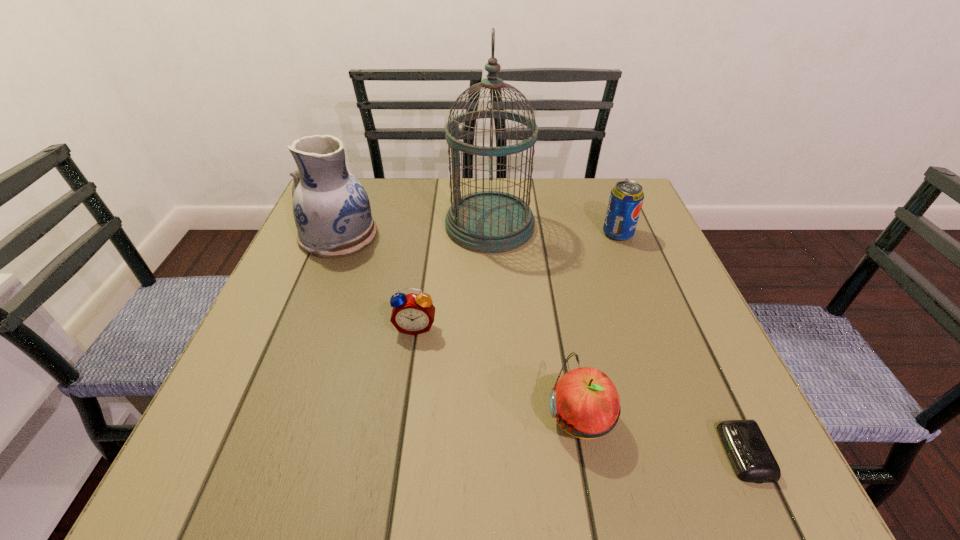
Find the location of a particular element. free space between the right alarm clock and the tallest object is located at coordinates (616, 339).

Image resolution: width=960 pixels, height=540 pixels. Find the location of `unoccupied position between the shorter alarm clock and the second tallest object`. unoccupied position between the shorter alarm clock and the second tallest object is located at coordinates (541, 344).

Find the location of a particular element. The height and width of the screenshot is (540, 960). vacant area that lies between the taller alarm clock and the apple is located at coordinates (497, 372).

Locate which object ranks fifth in proximity to the taller alarm clock. Please provide its 2D coordinates. Your answer should be formatted as a tuple, i.e. [(x, y)], where the tuple contains the x and y coordinates of a point satisfying the conditions above.

[(747, 449)]

Point out which object is positioned as the fifth nearest to the second tallest object. Please provide its 2D coordinates. Your answer should be formatted as a tuple, i.e. [(x, y)], where the tuple contains the x and y coordinates of a point satisfying the conditions above.

[(747, 449)]

The height and width of the screenshot is (540, 960). I want to click on free location that satisfies the following two spatial constraints: 1. on the front-facing side of the tallest object; 2. on the left side of the soda, so click(490, 234).

At what (x,y) coordinates should I click in order to perform the action: click on vacant space that satisfies the following two spatial constraints: 1. on the front-facing side of the tallest object; 2. on the front-facing side of the left alarm clock. Please return your answer as a coordinate pair (x, y). The height and width of the screenshot is (540, 960). Looking at the image, I should click on (492, 327).

Identify the location of free point that satisfies the following two spatial constraints: 1. on the front-facing side of the soda; 2. on the right side of the birdcage. (490, 234).

Locate an element on the screen. free location that satisfies the following two spatial constraints: 1. on the back side of the apple; 2. on the left side of the soda is located at coordinates (545, 234).

This screenshot has width=960, height=540. I want to click on free space that satisfies the following two spatial constraints: 1. on the front-facing side of the soda; 2. on the left side of the tallest object, so click(x=490, y=234).